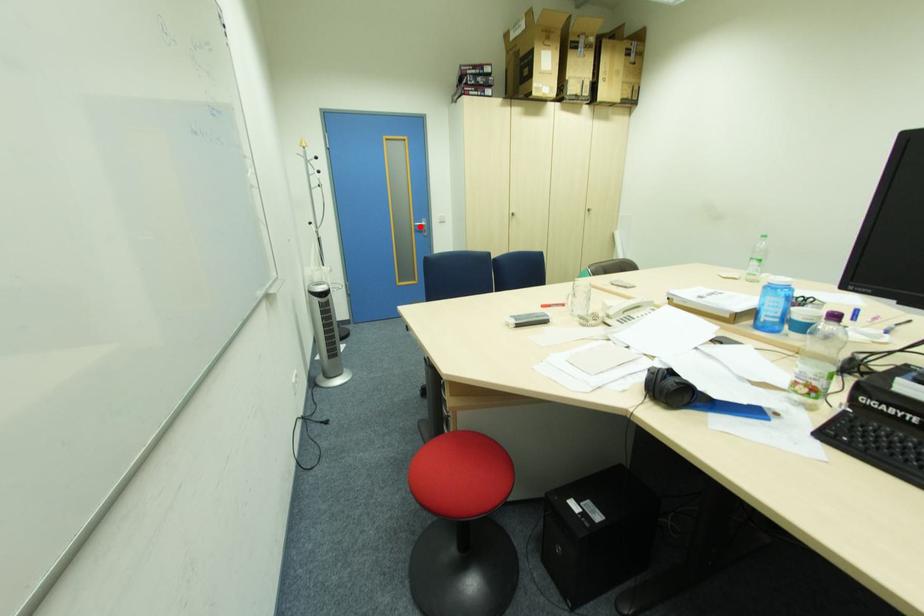
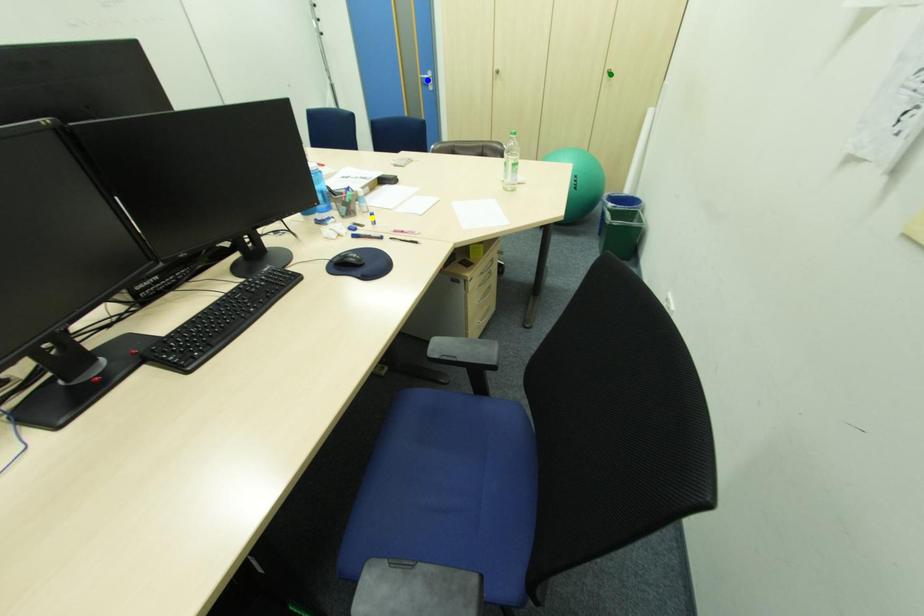
Question: I am providing you with two images of the same scene from different viewpoints. A red point is marked on the first image. You are given multiple points on the second image. Which point in image 2 is actually the same real-world point as the red point in image 1?

Choices:
 (A) green point
 (B) yellow point
 (C) blue point

Answer: (C)